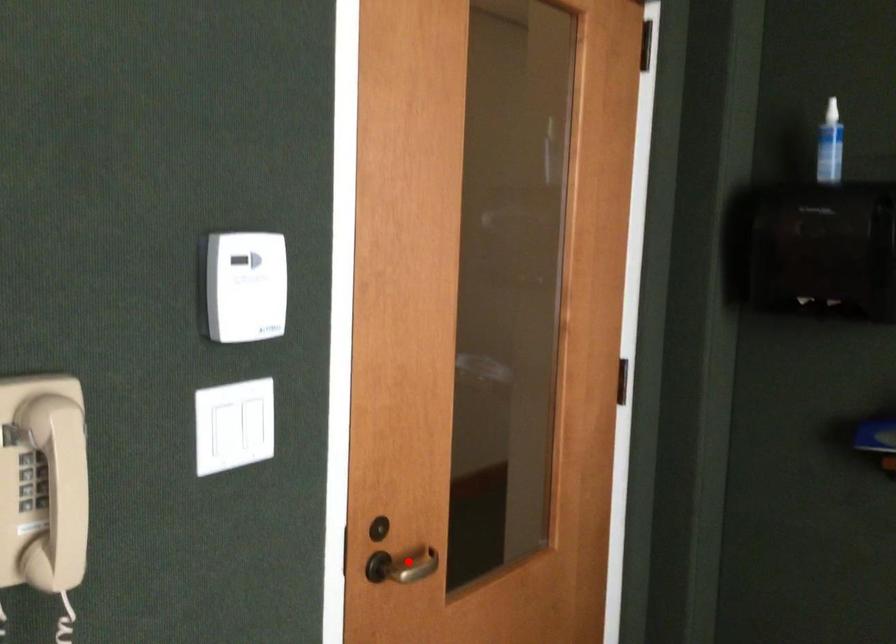
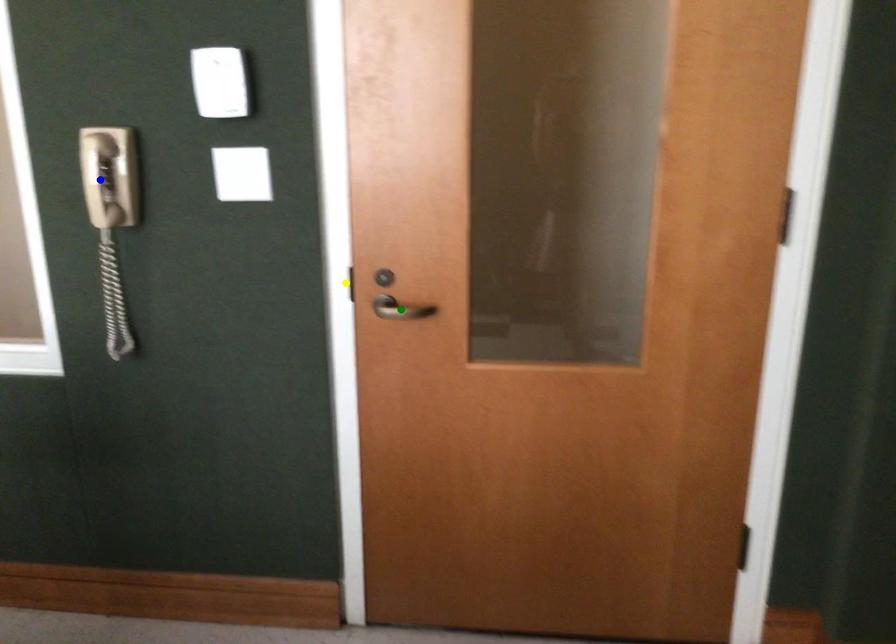
Question: I am providing you with two images of the same scene from different viewpoints. A red point is marked on the first image. You are given multiple points on the second image. Which mark in image 2 goes with the point in image 1?

Choices:
 (A) blue point
 (B) green point
 (C) yellow point

Answer: (B)